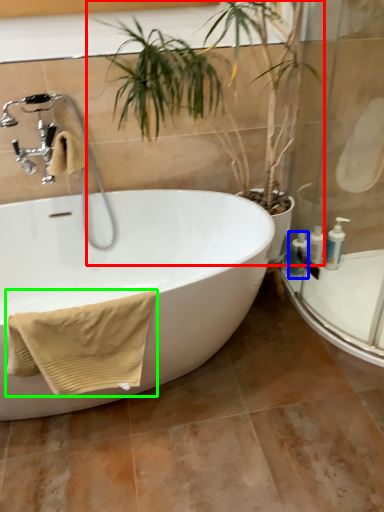
Question: Estimate the real-world distances between objects in this image. Which object is closer to houseplant (highlighted by a red box), toiletry (highlighted by a blue box) or bath towel (highlighted by a green box)?

Choices:
 (A) toiletry
 (B) bath towel

Answer: (A)